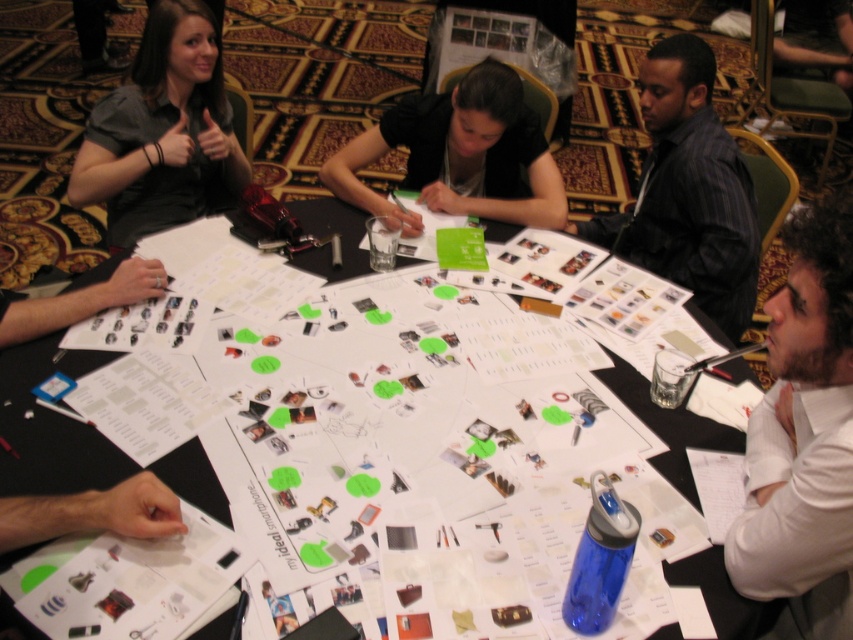
Is white shirt at lower right positioned at the back of matte black shirt at upper left?

No, it is in front of matte black shirt at upper left.

In the scene shown: Which of these two, white shirt at lower right or matte black shirt at upper left, stands shorter?

white shirt at lower right

Is point (811, 220) positioned after point (134, 136)?

No.

The height and width of the screenshot is (640, 853). What are the coordinates of `white shirt at lower right` in the screenshot? It's located at (804, 438).

Does white paper at center appear under matte black shirt at upper left?

Correct, white paper at center is located below matte black shirt at upper left.

Between white paper at center and matte black shirt at upper left, which one has more height?

matte black shirt at upper left

What do you see at coordinates (50, 426) in the screenshot? I see `white paper at center` at bounding box center [50, 426].

Image resolution: width=853 pixels, height=640 pixels. Find the location of `white paper at center`. white paper at center is located at coordinates (50, 426).

In the scene shown: Who is shorter, white paper at center or matte black shirt at upper center?

Standing shorter between the two is matte black shirt at upper center.

Which is behind, point (7, 483) or point (469, 200)?

Point (469, 200)

Is point (22, 394) behind point (474, 168)?

No, it is in front of (474, 168).

You are a GUI agent. You are given a task and a screenshot of the screen. Output one action in this format:
    pyautogui.click(x=<x>, y=<y>)
    Task: Click on the white paper at center
    
    Given the screenshot: What is the action you would take?
    pyautogui.click(x=50, y=426)